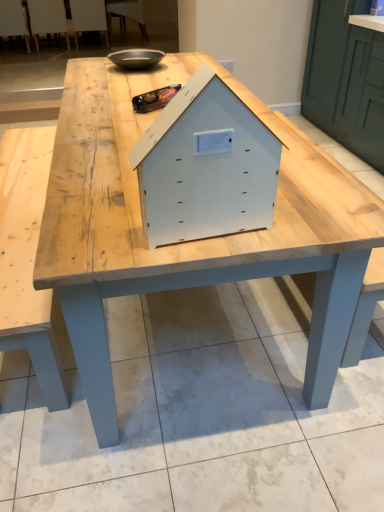
This screenshot has width=384, height=512. Find the location of `white matte wooden house at center`. white matte wooden house at center is located at coordinates (205, 166).

The image size is (384, 512). Describe the element at coordinates (13, 20) in the screenshot. I see `wooden chair at upper left, the first chair positioned from the left` at that location.

At what (x,y) coordinates should I click in order to perform the action: click on light wood table at center. Please return your answer as a coordinate pair (x, y). The height and width of the screenshot is (512, 384). Looking at the image, I should click on (192, 241).

Identify the location of white plastic chair at upper left, which is counted as the 3th chair, starting from the left. The width and height of the screenshot is (384, 512). (88, 17).

Measure the distance between point (x=145, y=57) and camera.

Point (x=145, y=57) is 7.70 feet away from camera.

In order to face matte black bowl at upper center, should I rotate leftwards or rightwards?

To face it directly, rotate left by 7.227 degrees.

At what (x,y) coordinates should I click in order to perform the action: click on white matte wooden house at center. Please return your answer as a coordinate pair (x, y). Image resolution: width=384 pixels, height=512 pixels. Looking at the image, I should click on (205, 166).

Is point (9, 2) closer or farther from the camera than point (53, 13)?

Clearly, point (9, 2) is closer to the camera than point (53, 13).

What are the coordinates of `chair on the left of white plastic chair at upper left, which ranks as the 2th chair in left-to-right order` in the screenshot? It's located at (13, 20).

Would you say wooden chair at upper left, the fourth chair in the right-to-left sequence, is to the left or to the right of white plastic chair at upper left, which ranks as the 2th chair in left-to-right order, in the picture?

Based on their positions, wooden chair at upper left, the fourth chair in the right-to-left sequence, is located to the left of white plastic chair at upper left, which ranks as the 2th chair in left-to-right order.

Consider the image. Are wooden chair at upper left, the first chair positioned from the left, and white plastic chair at upper left, the 3th chair from the right, far apart?

wooden chair at upper left, the first chair positioned from the left, is actually quite close to white plastic chair at upper left, the 3th chair from the right.

From a real-world perspective, is white plastic chair at upper center, which ranks as the 1th chair in right-to-left order, on top of light wood table at center?

Yes, from a real-world perspective, white plastic chair at upper center, which ranks as the 1th chair in right-to-left order, is on top of light wood table at center.

Does white plastic chair at upper center, which ranks as the 1th chair in right-to-left order, appear on the left side of light wood table at center?

Yes.

The height and width of the screenshot is (512, 384). I want to click on chair that is the 1st object to the left of the light wood table at center, starting at the anchor, so click(x=126, y=15).

Considering the relative sizes of white plastic chair at upper center, which is counted as the 4th chair, starting from the left, and light wood table at center in the image provided, is white plastic chair at upper center, which is counted as the 4th chair, starting from the left, taller than light wood table at center?

No.

Is white plastic chair at upper center, which is counted as the 4th chair, starting from the left, located outside wooden chair at upper left, the fourth chair in the right-to-left sequence?

Yes, white plastic chair at upper center, which is counted as the 4th chair, starting from the left, is not within wooden chair at upper left, the fourth chair in the right-to-left sequence.

Considering the sizes of objects white plastic chair at upper center, which is counted as the 4th chair, starting from the left, and wooden chair at upper left, the fourth chair in the right-to-left sequence, in the image provided, who is thinner, white plastic chair at upper center, which is counted as the 4th chair, starting from the left, or wooden chair at upper left, the fourth chair in the right-to-left sequence,?

Result: wooden chair at upper left, the fourth chair in the right-to-left sequence.

Can you see white plastic chair at upper center, which ranks as the 1th chair in right-to-left order, touching wooden chair at upper left, the first chair positioned from the left?

No.

Is white plastic chair at upper center, which is counted as the 4th chair, starting from the left, not inside matte black bowl at upper center?

Yes, white plastic chair at upper center, which is counted as the 4th chair, starting from the left, is outside of matte black bowl at upper center.

How distant is white plastic chair at upper center, which is counted as the 4th chair, starting from the left, from matte black bowl at upper center?

3.60 meters.

Based on the photo, which object is wider, white plastic chair at upper center, which ranks as the 1th chair in right-to-left order, or matte black bowl at upper center?

white plastic chair at upper center, which ranks as the 1th chair in right-to-left order, is wider.

Is the position of white plastic chair at upper center, which is counted as the 4th chair, starting from the left, less distant than that of matte black bowl at upper center?

No, it is behind matte black bowl at upper center.

How distant is white plastic chair at upper left, the 3th chair from the right, from white plastic chair at upper center, which ranks as the 1th chair in right-to-left order?

79.67 centimeters.

Is point (44, 24) closer or farther from the camera than point (140, 0)?

Point (44, 24) appears to be farther away from the viewer than point (140, 0).

Can you confirm if white plastic chair at upper left, which ranks as the 2th chair in left-to-right order, is wider than white plastic chair at upper center, which is counted as the 4th chair, starting from the left?

No, white plastic chair at upper left, which ranks as the 2th chair in left-to-right order, is not wider than white plastic chair at upper center, which is counted as the 4th chair, starting from the left.

In terms of size, does white plastic chair at upper left, which ranks as the 2th chair in left-to-right order, appear bigger or smaller than white plastic chair at upper center, which ranks as the 1th chair in right-to-left order?

Clearly, white plastic chair at upper left, which ranks as the 2th chair in left-to-right order, is smaller in size than white plastic chair at upper center, which ranks as the 1th chair in right-to-left order.

Is wooden chair at upper left, the fourth chair in the right-to-left sequence, facing towards white plastic chair at upper center, which is counted as the 4th chair, starting from the left?

No, wooden chair at upper left, the fourth chair in the right-to-left sequence, is not aimed at white plastic chair at upper center, which is counted as the 4th chair, starting from the left.

Considering the relative sizes of wooden chair at upper left, the first chair positioned from the left, and white plastic chair at upper center, which ranks as the 1th chair in right-to-left order, in the image provided, is wooden chair at upper left, the first chair positioned from the left, smaller than white plastic chair at upper center, which ranks as the 1th chair in right-to-left order,?

Correct, wooden chair at upper left, the first chair positioned from the left, occupies less space than white plastic chair at upper center, which ranks as the 1th chair in right-to-left order.

Considering the relative sizes of wooden chair at upper left, the fourth chair in the right-to-left sequence, and white plastic chair at upper center, which ranks as the 1th chair in right-to-left order, in the image provided, is wooden chair at upper left, the fourth chair in the right-to-left sequence, thinner than white plastic chair at upper center, which ranks as the 1th chair in right-to-left order,?

Yes, wooden chair at upper left, the fourth chair in the right-to-left sequence, is thinner than white plastic chair at upper center, which ranks as the 1th chair in right-to-left order.

Which object is further away from the camera, wooden chair at upper left, the first chair positioned from the left, or white plastic chair at upper center, which ranks as the 1th chair in right-to-left order?

white plastic chair at upper center, which ranks as the 1th chair in right-to-left order, is further away from the camera.

Consider the image. Does white plastic chair at upper left, the second chair viewed from the right, appear on the right side of light wood table at center?

In fact, white plastic chair at upper left, the second chair viewed from the right, is to the left of light wood table at center.

Could you tell me if white plastic chair at upper left, the second chair viewed from the right, is turned towards light wood table at center?

No, white plastic chair at upper left, the second chair viewed from the right, is not turned towards light wood table at center.

How different are the orientations of white plastic chair at upper left, the second chair viewed from the right, and light wood table at center in degrees?

The angular difference between white plastic chair at upper left, the second chair viewed from the right, and light wood table at center is 180 degrees.

What are the coordinates of `chair that is the 3rd object located behind the light wood table at center` in the screenshot? It's located at coord(88,17).

The image size is (384, 512). I want to click on chair below the white plastic chair at upper left, the 3th chair from the right (from the image's perspective), so click(13, 20).

You are a GUI agent. You are given a task and a screenshot of the screen. Output one action in this format:
    pyautogui.click(x=<x>, y=<y>)
    Task: Click on the 4th chair above the light wood table at center (from the image's perspective)
    The height and width of the screenshot is (512, 384).
    Given the screenshot: What is the action you would take?
    pyautogui.click(x=126, y=15)

Looking at the image, which one is located further to wooden chair at upper left, the first chair positioned from the left, white matte wooden house at center or white plastic chair at upper center, which ranks as the 1th chair in right-to-left order?

white matte wooden house at center is positioned further to the anchor wooden chair at upper left, the first chair positioned from the left.

Which object lies further to the anchor point white matte wooden house at center, matte black bowl at upper center or white plastic chair at upper left, which ranks as the 2th chair in left-to-right order?

white plastic chair at upper left, which ranks as the 2th chair in left-to-right order, lies further to white matte wooden house at center than the other object.

Estimate the real-world distances between objects in this image. Which object is further from light wood table at center, wooden chair at upper left, the fourth chair in the right-to-left sequence, or white plastic chair at upper center, which is counted as the 4th chair, starting from the left?

wooden chair at upper left, the fourth chair in the right-to-left sequence, lies further to light wood table at center than the other object.

Looking at the image, which one is located closer to matte black bowl at upper center, white plastic chair at upper center, which is counted as the 4th chair, starting from the left, or wooden chair at upper left, the fourth chair in the right-to-left sequence?

Based on the image, white plastic chair at upper center, which is counted as the 4th chair, starting from the left, appears to be nearer to matte black bowl at upper center.

Which object lies nearer to the anchor point white plastic chair at upper left, the 3th chair from the right, matte black bowl at upper center or white plastic chair at upper left, the second chair viewed from the right?

white plastic chair at upper left, the second chair viewed from the right.

Estimate the real-world distances between objects in this image. Which object is further from matte black bowl at upper center, wooden chair at upper left, the first chair positioned from the left, or light wood table at center?

wooden chair at upper left, the first chair positioned from the left.

Which object lies further to the anchor point white plastic chair at upper center, which is counted as the 4th chair, starting from the left, white plastic chair at upper left, which ranks as the 2th chair in left-to-right order, or white plastic chair at upper left, the second chair viewed from the right?

white plastic chair at upper left, which ranks as the 2th chair in left-to-right order, is positioned further to the anchor white plastic chair at upper center, which is counted as the 4th chair, starting from the left.

Which object lies nearer to the anchor point white plastic chair at upper left, which is counted as the 3th chair, starting from the left, wooden chair at upper left, the fourth chair in the right-to-left sequence, or matte black bowl at upper center?

wooden chair at upper left, the fourth chair in the right-to-left sequence, is positioned closer to the anchor white plastic chair at upper left, which is counted as the 3th chair, starting from the left.

Identify the location of bowl positioned between light wood table at center and white plastic chair at upper center, which is counted as the 4th chair, starting from the left, from near to far. (136, 58).

The width and height of the screenshot is (384, 512). In order to click on table positioned between white matte wooden house at center and matte black bowl at upper center from near to far in this screenshot , I will do `click(192, 241)`.

The image size is (384, 512). Find the location of `chair between white matte wooden house at center and white plastic chair at upper left, which ranks as the 2th chair in left-to-right order, from front to back`. chair between white matte wooden house at center and white plastic chair at upper left, which ranks as the 2th chair in left-to-right order, from front to back is located at coordinates (13, 20).

Image resolution: width=384 pixels, height=512 pixels. In order to click on chair between wooden chair at upper left, the first chair positioned from the left, and white plastic chair at upper left, the second chair viewed from the right, from left to right in this screenshot , I will do `click(49, 19)`.